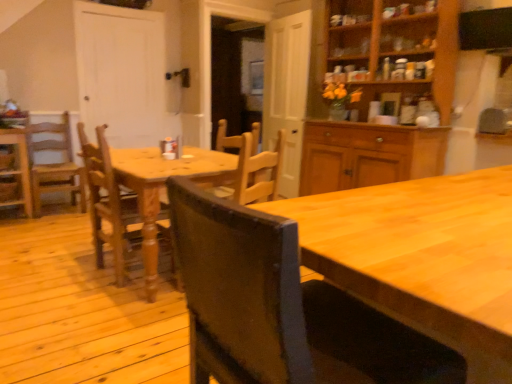
This screenshot has width=512, height=384. In order to click on free space in front of light brown wooden chair at left, acting as the 4th chair starting from the front in this screenshot , I will do (x=42, y=225).